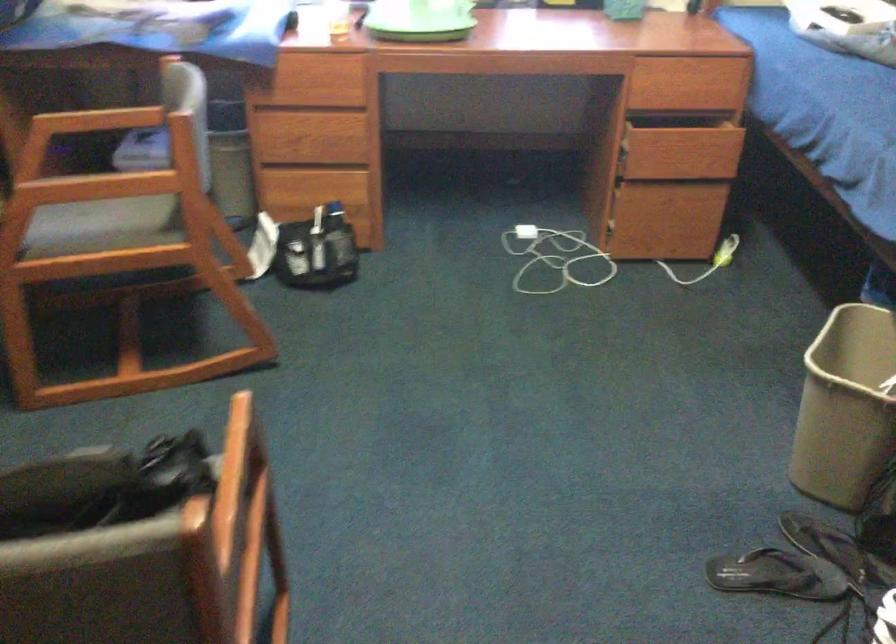
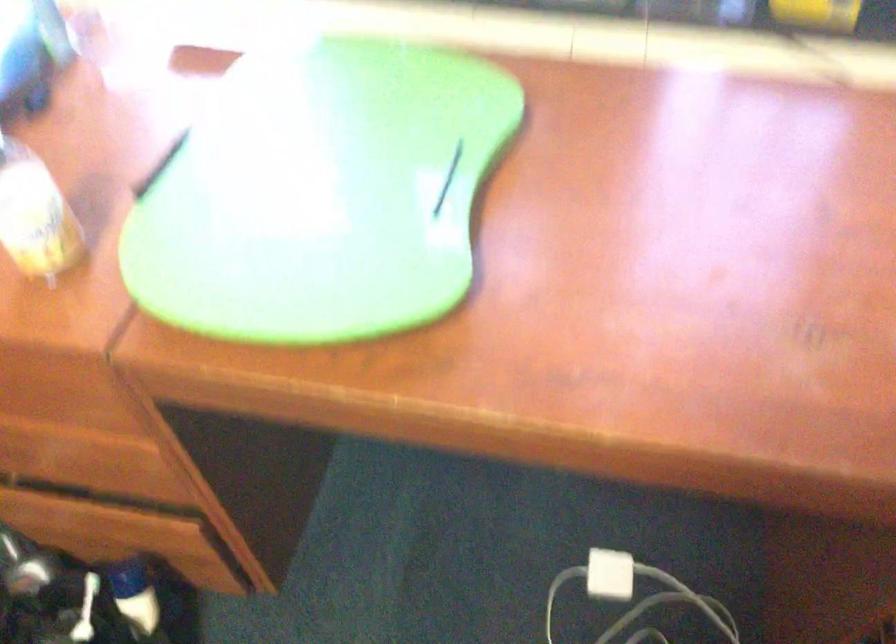
Question: In a continuous first-person perspective shot, in which direction is the camera moving?

Choices:
 (A) Left
 (B) Right
 (C) Forward
 (D) Backward

Answer: (C)